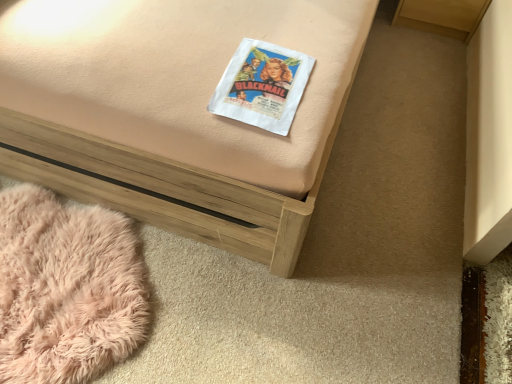
Question: Is fluffy pink rug at lower left placed right next to matte paper book at center?

Choices:
 (A) yes
 (B) no

Answer: (B)

Question: Is fluffy pink rug at lower left smaller than matte paper book at center?

Choices:
 (A) no
 (B) yes

Answer: (A)

Question: Is fluffy pink rug at lower left at the right side of matte paper book at center?

Choices:
 (A) yes
 (B) no

Answer: (B)

Question: From a real-world perspective, is fluffy pink rug at lower left on matte paper book at center?

Choices:
 (A) no
 (B) yes

Answer: (A)

Question: Can we say fluffy pink rug at lower left lies outside matte paper book at center?

Choices:
 (A) yes
 (B) no

Answer: (A)

Question: Would you say fluffy pink rug at lower left is to the left or to the right of matte paper book at center in the picture?

Choices:
 (A) right
 (B) left

Answer: (B)

Question: Is fluffy pink rug at lower left in front of or behind matte paper book at center in the image?

Choices:
 (A) front
 (B) behind

Answer: (B)

Question: From a real-world perspective, is fluffy pink rug at lower left above or below matte paper book at center?

Choices:
 (A) below
 (B) above

Answer: (A)

Question: In terms of width, does fluffy pink rug at lower left look wider or thinner when compared to matte paper book at center?

Choices:
 (A) wide
 (B) thin

Answer: (A)

Question: From a real-world perspective, relative to wooden bed frame at center, is fluffy pink rug at lower left vertically above or below?

Choices:
 (A) below
 (B) above

Answer: (A)

Question: Looking at their shapes, would you say fluffy pink rug at lower left is wider or thinner than wooden bed frame at center?

Choices:
 (A) wide
 (B) thin

Answer: (B)

Question: Do you think fluffy pink rug at lower left is within wooden bed frame at center, or outside of it?

Choices:
 (A) outside
 (B) inside

Answer: (A)

Question: Considering the positions of fluffy pink rug at lower left and wooden bed frame at center in the image, is fluffy pink rug at lower left bigger or smaller than wooden bed frame at center?

Choices:
 (A) big
 (B) small

Answer: (B)

Question: Is point click(104, 66) positioned closer to the camera than point click(258, 79)?

Choices:
 (A) closer
 (B) farther

Answer: (B)

Question: From the image's perspective, is wooden bed frame at center located above or below matte paper book at center?

Choices:
 (A) above
 (B) below

Answer: (A)